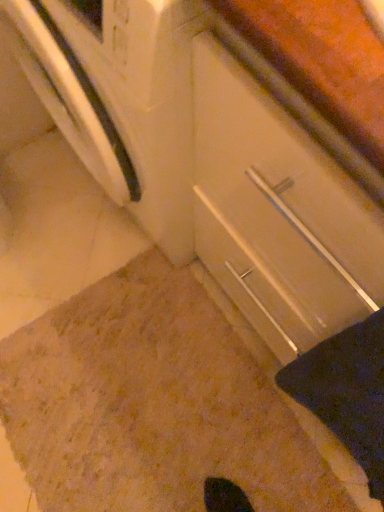
Question: Is black fabric at lower right thinner than brown textured carpet at lower center?

Choices:
 (A) no
 (B) yes

Answer: (B)

Question: Can we say black fabric at lower right lies outside brown textured carpet at lower center?

Choices:
 (A) yes
 (B) no

Answer: (A)

Question: Is black fabric at lower right to the right of brown textured carpet at lower center from the viewer's perspective?

Choices:
 (A) no
 (B) yes

Answer: (B)

Question: Would you say black fabric at lower right is a long distance from brown textured carpet at lower center?

Choices:
 (A) yes
 (B) no

Answer: (B)

Question: Is the depth of black fabric at lower right less than that of brown textured carpet at lower center?

Choices:
 (A) no
 (B) yes

Answer: (B)

Question: Is black fabric at lower right aimed at brown textured carpet at lower center?

Choices:
 (A) yes
 (B) no

Answer: (B)

Question: Is brown textured carpet at lower center beside white glossy drawer at center?

Choices:
 (A) no
 (B) yes

Answer: (A)

Question: From a real-world perspective, does brown textured carpet at lower center sit lower than white glossy drawer at center?

Choices:
 (A) no
 (B) yes

Answer: (B)

Question: Can you confirm if brown textured carpet at lower center is wider than white glossy drawer at center?

Choices:
 (A) no
 (B) yes

Answer: (B)

Question: Is brown textured carpet at lower center at the right side of white glossy drawer at center?

Choices:
 (A) no
 (B) yes

Answer: (A)

Question: From the image's perspective, is brown textured carpet at lower center beneath white glossy drawer at center?

Choices:
 (A) yes
 (B) no

Answer: (A)

Question: Can you confirm if brown textured carpet at lower center is taller than white glossy drawer at center?

Choices:
 (A) no
 (B) yes

Answer: (A)

Question: Is white glossy drawer at center beside black fabric at lower right?

Choices:
 (A) no
 (B) yes

Answer: (A)